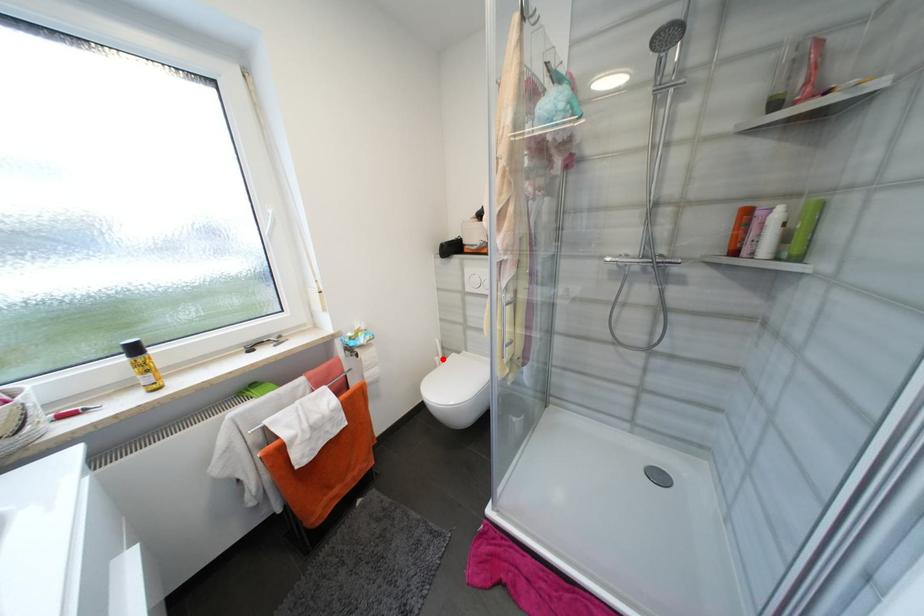
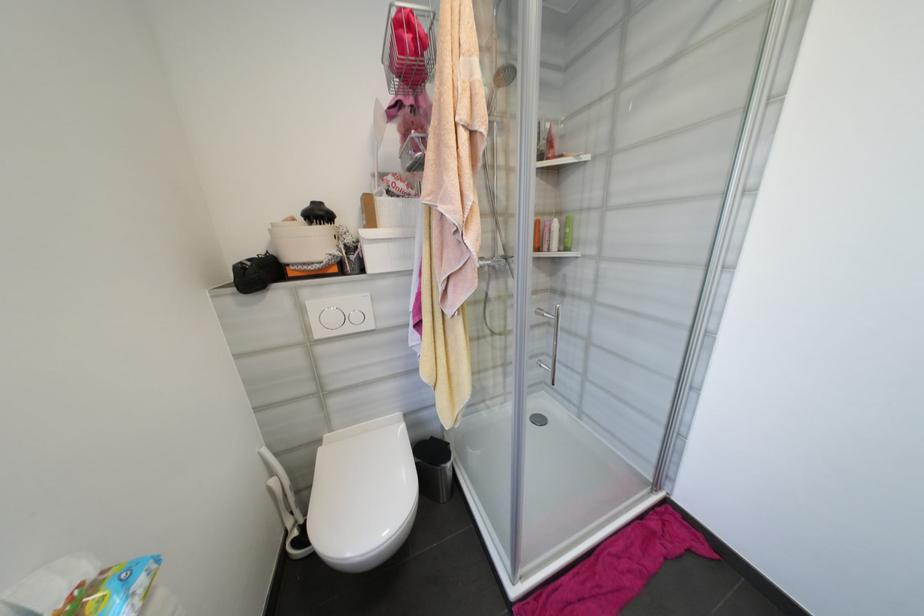
Question: I am providing you with two images of the same scene from different viewpoints. A red point is shown in image1. For the corresponding object point in image2, is it positioned nearer or farther from the camera?

Choices:
 (A) Nearer
 (B) Farther

Answer: (A)